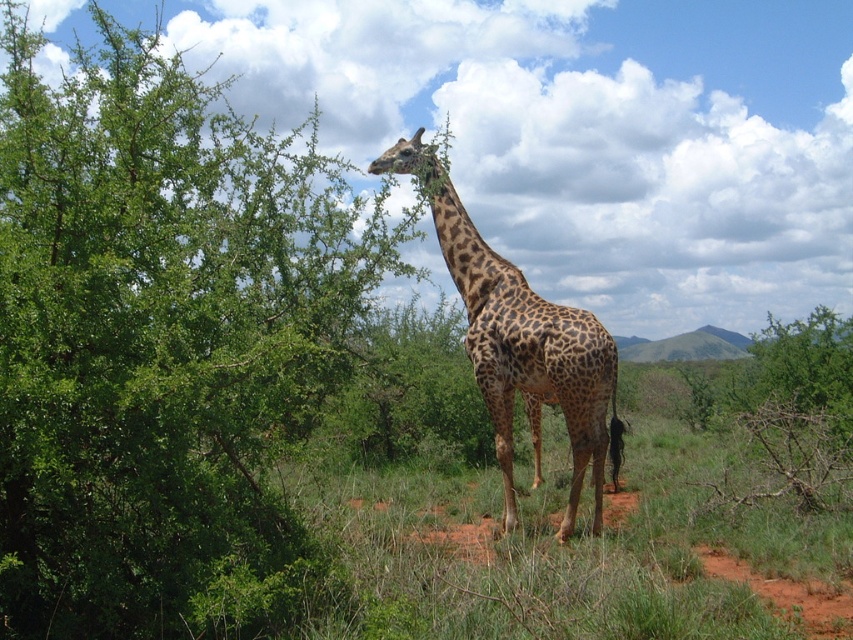
Question: Does green leafy tree at upper left appear on the left side of spotted fur giraffe at center?

Choices:
 (A) no
 (B) yes

Answer: (B)

Question: Which object is farther from the camera taking this photo?

Choices:
 (A) green leafy tree at upper left
 (B) spotted fur giraffe at center

Answer: (B)

Question: Considering the relative positions of green leafy tree at upper left and spotted fur giraffe at center in the image provided, where is green leafy tree at upper left located with respect to spotted fur giraffe at center?

Choices:
 (A) right
 (B) left

Answer: (B)

Question: Is green leafy tree at upper left positioned in front of spotted fur giraffe at center?

Choices:
 (A) yes
 (B) no

Answer: (A)

Question: Which point is closer to the camera taking this photo?

Choices:
 (A) (505, 328)
 (B) (96, 212)

Answer: (B)